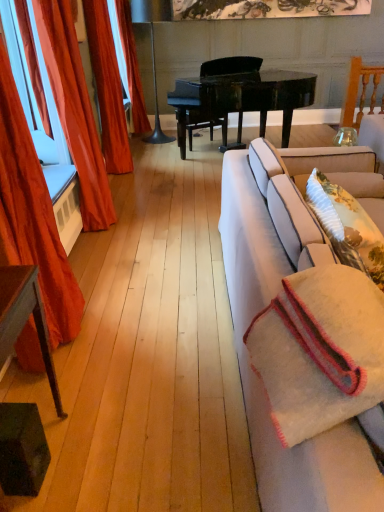
Where is `vacant area that lies to the right of velvet orange curtain at left, which appears as the third curtain when viewed from the back`? This screenshot has height=512, width=384. vacant area that lies to the right of velvet orange curtain at left, which appears as the third curtain when viewed from the back is located at coordinates (149, 222).